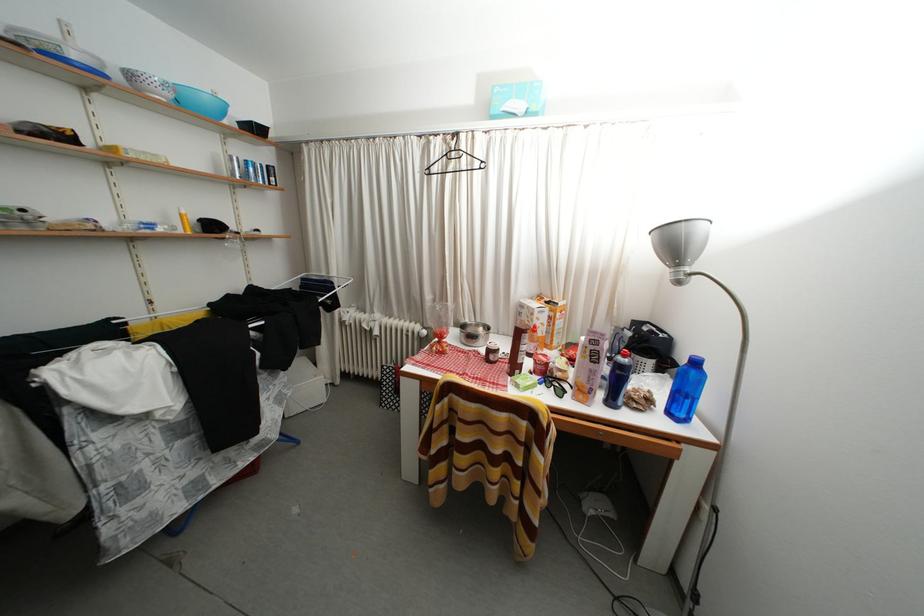
Where would you lift the black bottle? Please return your answer as a coordinate pair (x, y).

(617, 379)